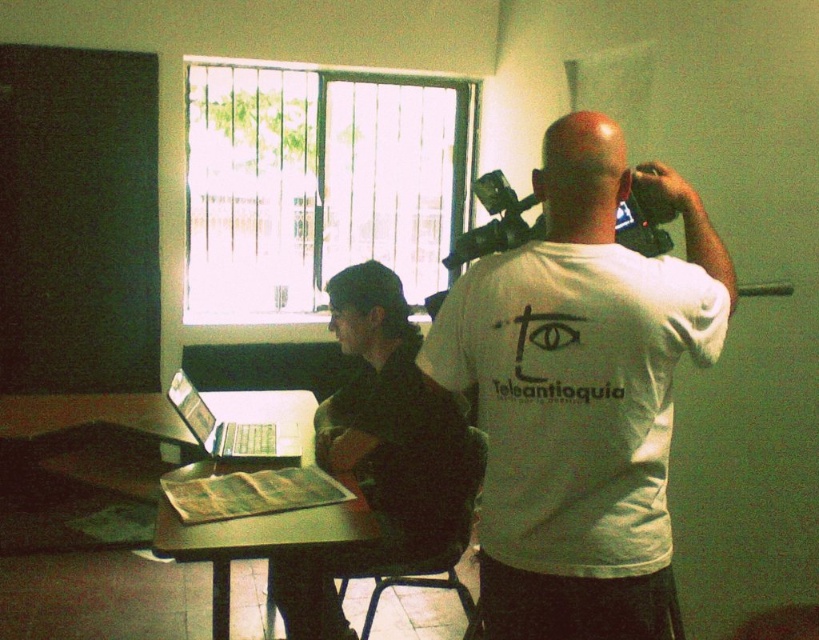
What do you see at coordinates (581, 394) in the screenshot? I see `white cotton shirt at center` at bounding box center [581, 394].

Which is more to the right, white cotton shirt at center or black plastic video camera at upper center?

white cotton shirt at center

Does point (607, 138) come behind point (519, 241)?

No, (607, 138) is in front of (519, 241).

In order to click on white cotton shirt at center in this screenshot , I will do `click(581, 394)`.

Which is above, wooden table at center or black plastic video camera at upper center?

black plastic video camera at upper center

Between wooden table at center and black plastic video camera at upper center, which one appears on the right side from the viewer's perspective?

From the viewer's perspective, black plastic video camera at upper center appears more on the right side.

What do you see at coordinates (252, 528) in the screenshot?
I see `wooden table at center` at bounding box center [252, 528].

Locate an element on the screen. Image resolution: width=819 pixels, height=640 pixels. wooden table at center is located at coordinates (252, 528).

Is dark green fabric shirt at center below black plastic video camera at upper center?

Yes, dark green fabric shirt at center is below black plastic video camera at upper center.

Who is more distant from viewer, (x=417, y=445) or (x=492, y=204)?

Positioned behind is point (x=417, y=445).

Which is behind, point (376, 352) or point (476, 252)?

The point (376, 352) is behind.

You are a GUI agent. You are given a task and a screenshot of the screen. Output one action in this format:
    pyautogui.click(x=<x>, y=<y>)
    Task: Click on the dark green fabric shirt at center
    
    Given the screenshot: What is the action you would take?
    pyautogui.click(x=392, y=419)